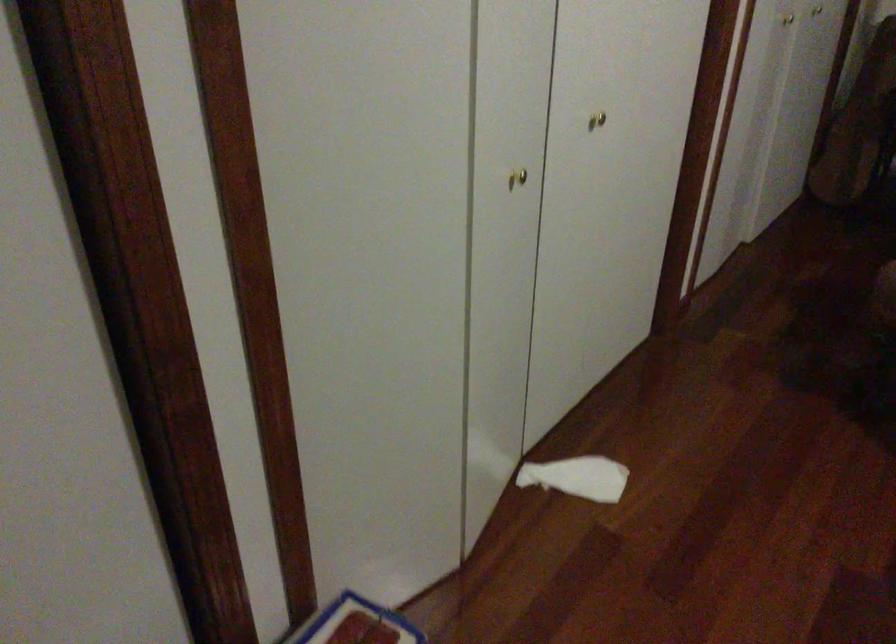
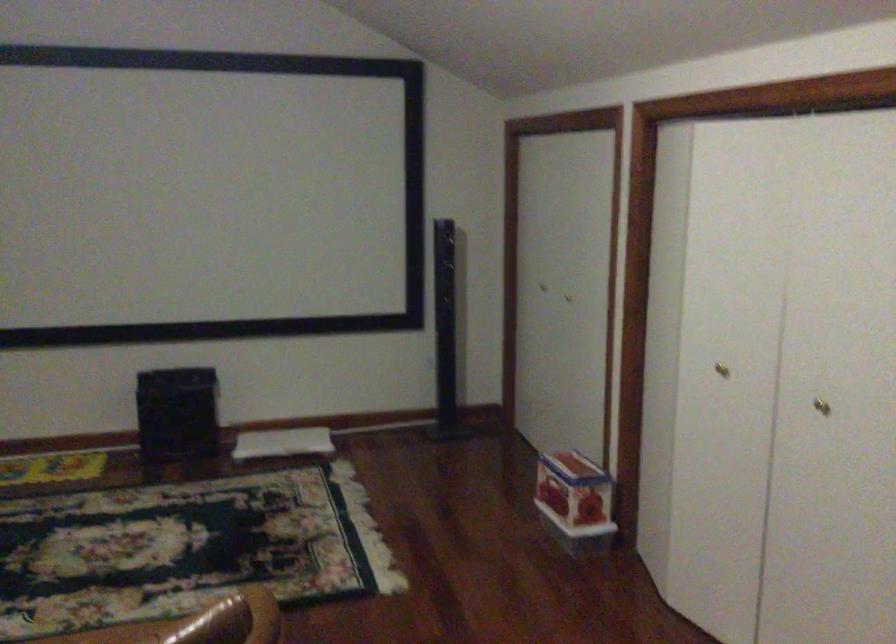
Where in the second image is the point corresponding to the point at 604,108 from the first image?

(821, 406)